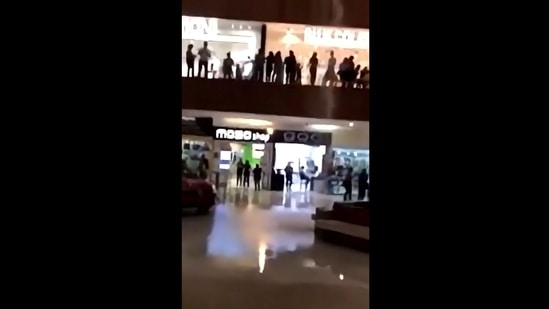
Locate an element on the screen. floor is located at coordinates (300, 265).